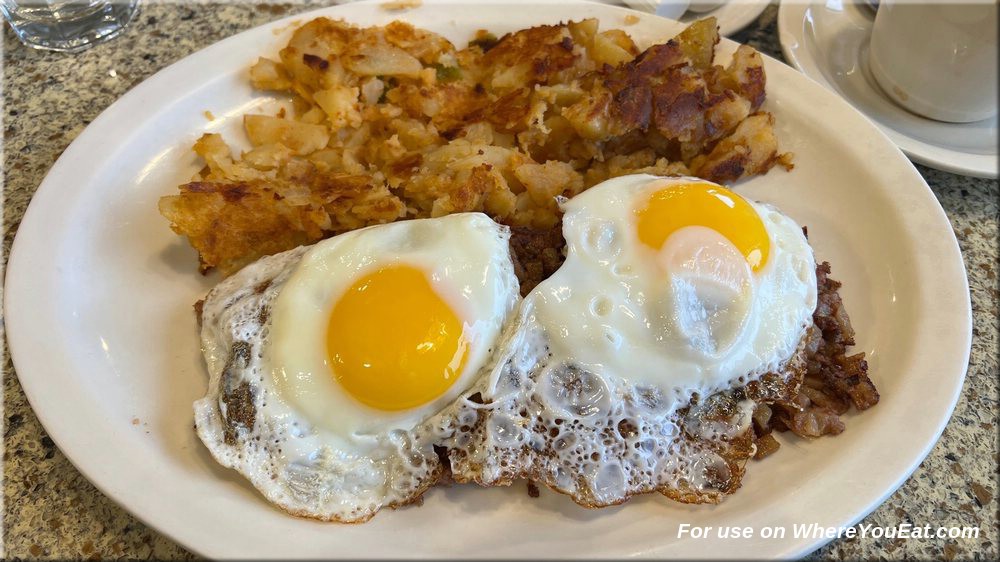
This screenshot has width=1000, height=562. Find the location of `saucer`. saucer is located at coordinates (807, 51).